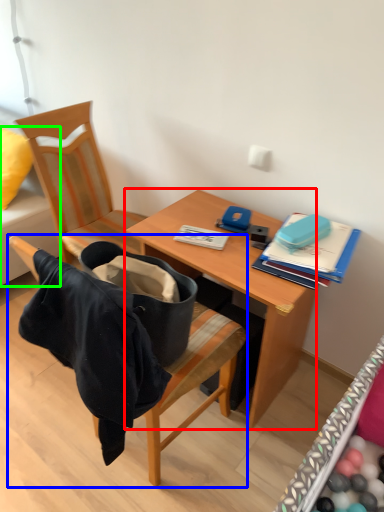
Question: Estimate the real-world distances between objects in this image. Which object is closer to desk (highlighted by a red box), chair (highlighted by a blue box) or studio couch (highlighted by a green box)?

Choices:
 (A) chair
 (B) studio couch

Answer: (A)